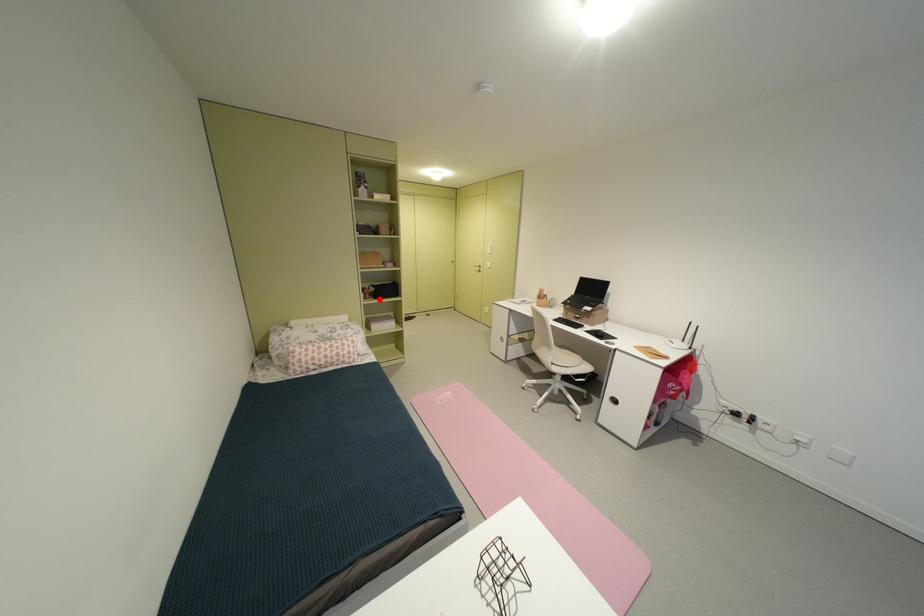
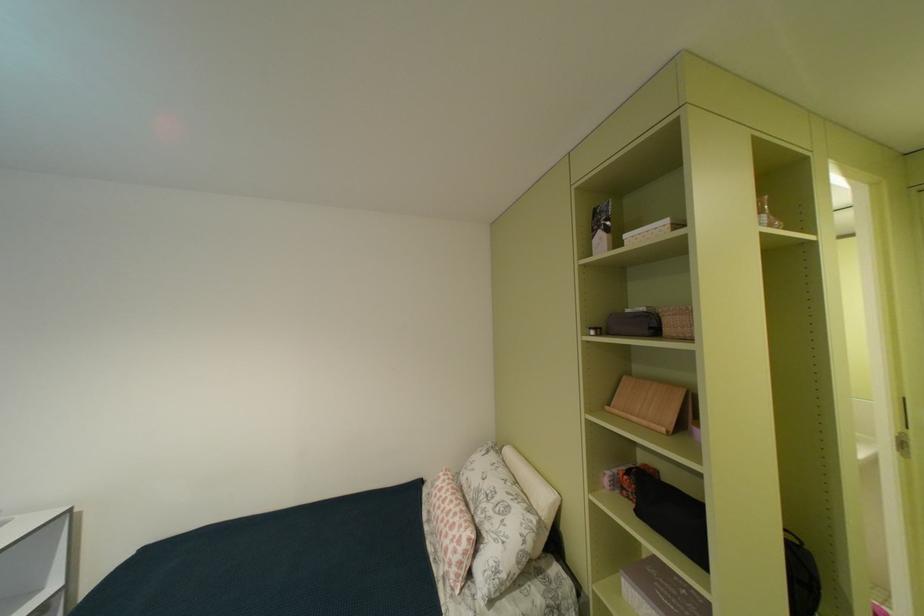
In the second image, find the point that corresponds to the highlighted location in the first image.

(641, 501)